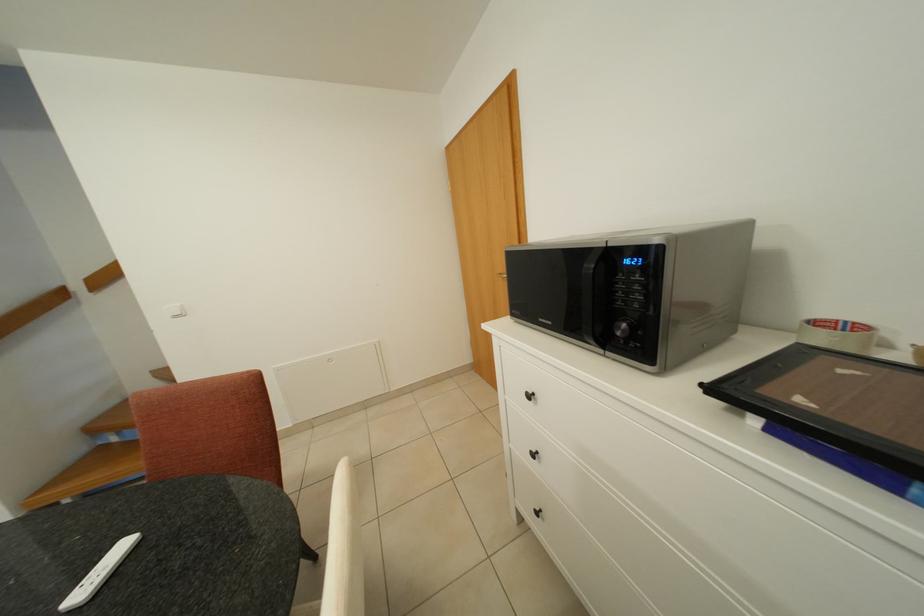
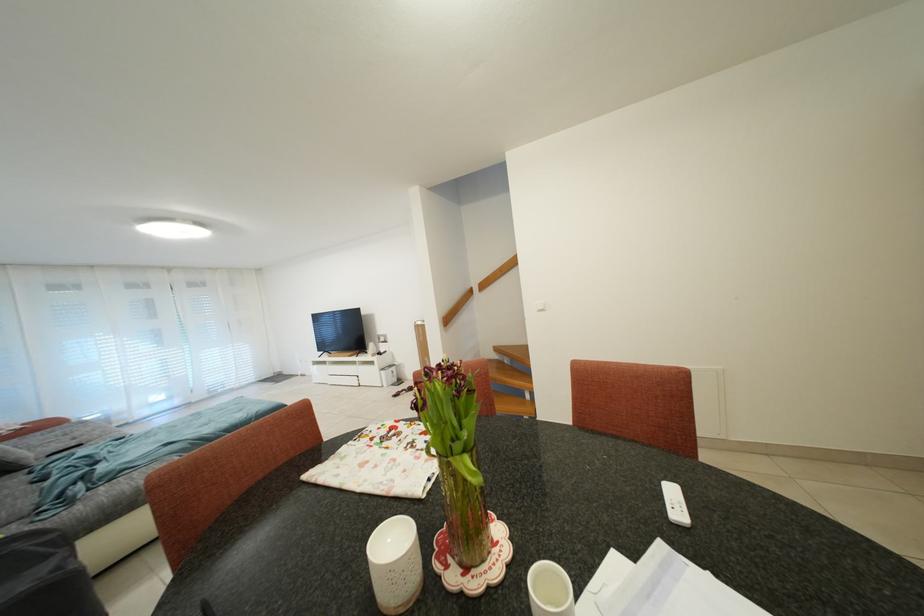
Question: Based on the continuous images, in which direction is the camera rotating? Reply with the corresponding letter.

Choices:
 (A) Left
 (B) Right
 (C) Up
 (D) Down

Answer: (A)